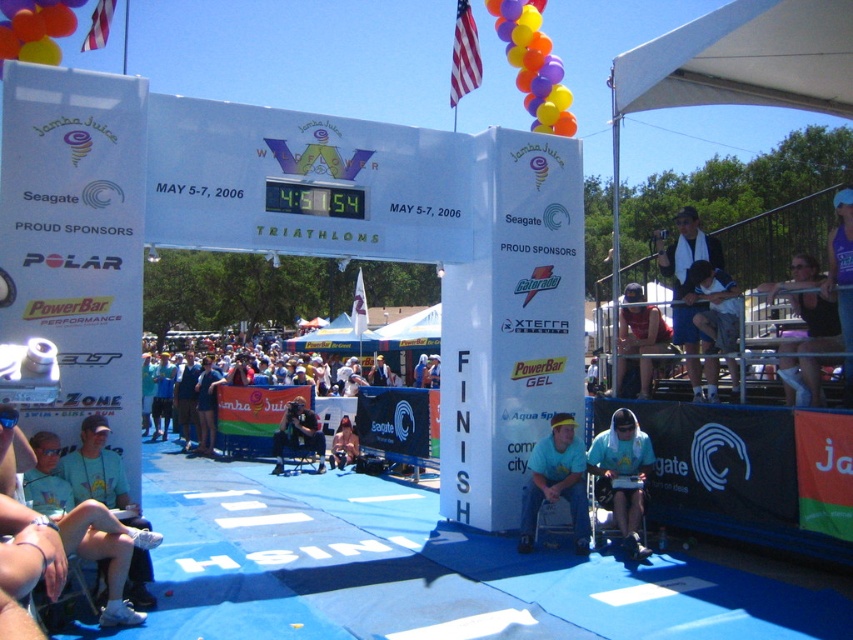
Question: Which of the following is the farthest from the observer?

Choices:
 (A) (561, 125)
 (B) (694, 339)
 (C) (631, 552)
 (D) (811, 339)

Answer: (A)

Question: Which object is the closest to the light blue t-shirt at center?

Choices:
 (A) dark blue shorts at upper right
 (B) orange glossy balloons at upper center
 (C) black fabric tank top at right
 (D) matte black camera at center

Answer: (A)

Question: Is dark blue shorts at upper right bigger than light blue shirt at center?

Choices:
 (A) yes
 (B) no

Answer: (A)

Question: Can you confirm if black fabric tank top at right is positioned to the right of matte red tank top at center?

Choices:
 (A) yes
 (B) no

Answer: (A)

Question: Which is farther from the light blue t-shirt at center?

Choices:
 (A) black fabric tank top at right
 (B) white fabric canopy at upper right

Answer: (B)

Question: Is matte black camera at center wider than tan leather jacket at center?

Choices:
 (A) yes
 (B) no

Answer: (A)